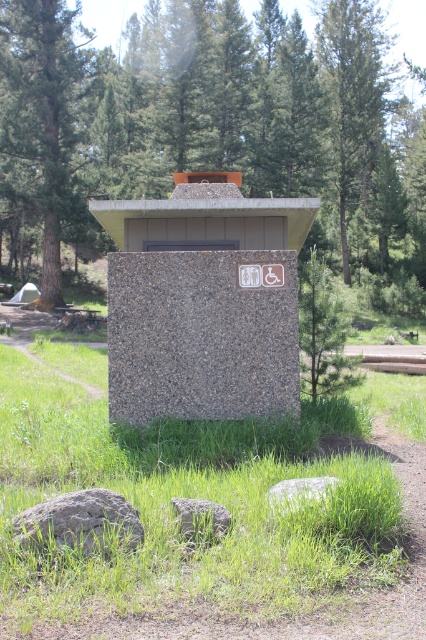
You are standing in front of the restroom facility and notice two landmarks nearby. The green textured tree at center and the gray granite rock at lower center. Which one is positioned to the left when facing the restroom?

The green textured tree at center is positioned to the left of the gray granite rock at lower center when facing the restroom.